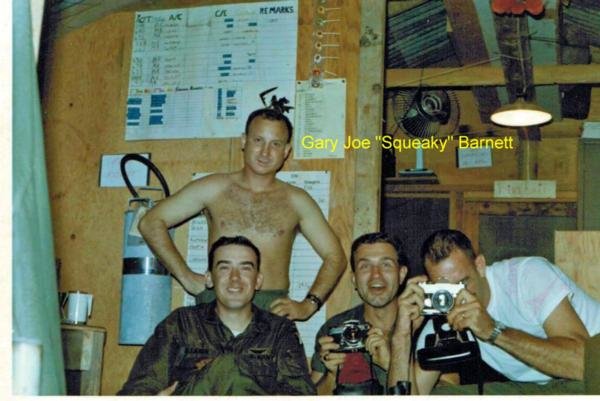
This screenshot has width=600, height=401. Identify the location of base of fan. (413, 168).